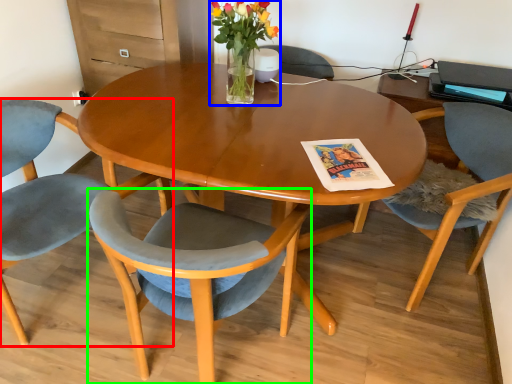
Question: Which object is the closest to the chair (highlighted by a red box)? Choose among these: floral arrangement (highlighted by a blue box) or chair (highlighted by a green box).

Choices:
 (A) floral arrangement
 (B) chair

Answer: (B)